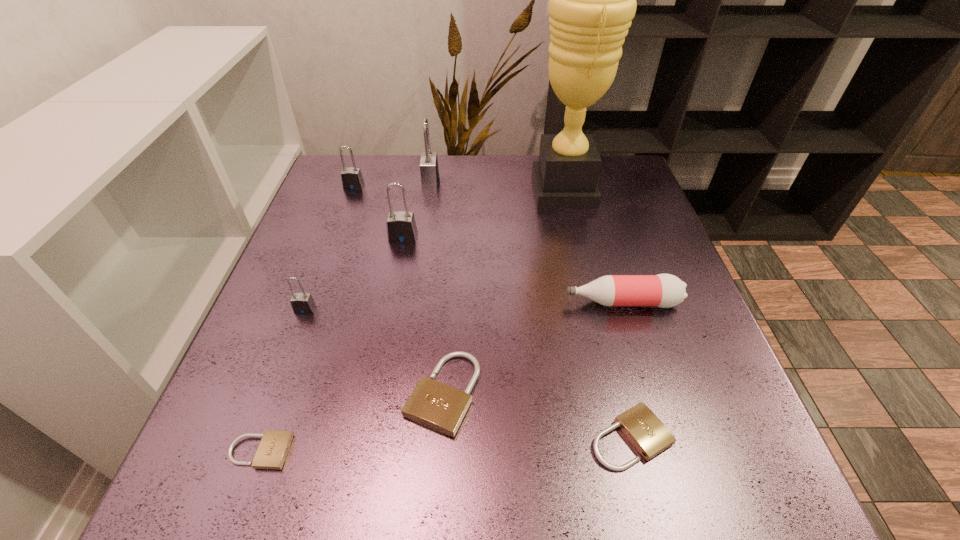
Locate an element on the screen. the tallest object is located at coordinates (592, 0).

The width and height of the screenshot is (960, 540). Find the location of `trophy cup`. trophy cup is located at coordinates (592, 0).

Locate an element on the screen. This screenshot has width=960, height=540. the second tallest object is located at coordinates (429, 170).

Where is `the tallest padlock`? This screenshot has height=540, width=960. the tallest padlock is located at coordinates (429, 170).

This screenshot has height=540, width=960. Identify the location of the fourth farthest object. (401, 227).

I want to click on the second nearest gray padlock, so click(401, 227).

Where is `the fourth tallest object`? The image size is (960, 540). the fourth tallest object is located at coordinates (352, 179).

I want to click on the third biggest gray padlock, so click(x=352, y=179).

Locate an element on the screen. This screenshot has height=540, width=960. the fifth shortest object is located at coordinates (302, 303).

You are a GUI agent. You are given a task and a screenshot of the screen. Output one action in this format:
    pyautogui.click(x=<x>, y=<y>)
    Task: Click on the nearest gray padlock
    This screenshot has width=960, height=540.
    Given the screenshot: What is the action you would take?
    pyautogui.click(x=302, y=303)